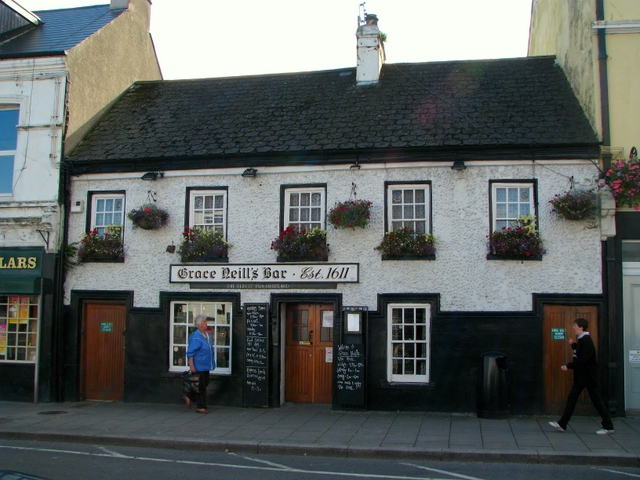
The height and width of the screenshot is (480, 640). In order to click on doors in this screenshot , I will do pos(314,358), pos(98,352), pos(557,346).